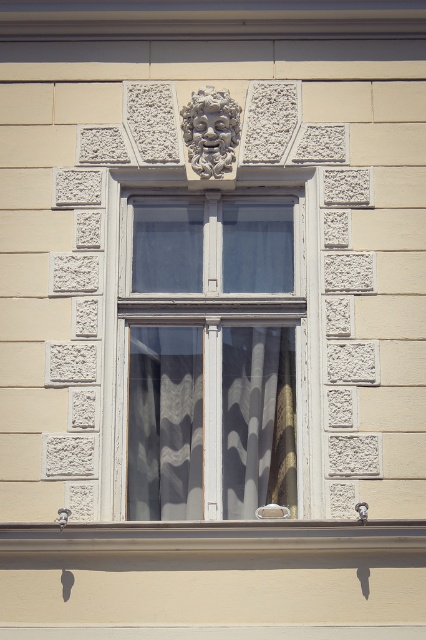
In the scene shown: You are an architect inspecting the building facade. You notice the white wood window at center and the white lace curtain at center. According to the spatial arrangement, which object is positioned to the right?

The white lace curtain at center is positioned to the right of the white wood window at center.